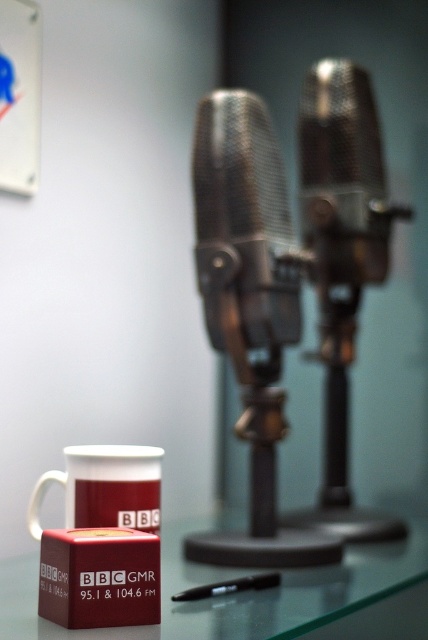
Can you confirm if matte cardboard box at lower left is positioned below black plastic pen at lower center?

No, matte cardboard box at lower left is not below black plastic pen at lower center.

Does matte cardboard box at lower left have a greater height compared to black plastic pen at lower center?

Indeed, matte cardboard box at lower left has a greater height compared to black plastic pen at lower center.

This screenshot has width=428, height=640. What do you see at coordinates (98, 577) in the screenshot? I see `matte cardboard box at lower left` at bounding box center [98, 577].

Identify the location of matte cardboard box at lower left. (98, 577).

Between matte cardboard box at lower left and white ceramic mug at lower left, which one is positioned higher?

white ceramic mug at lower left is above.

What do you see at coordinates (98, 577) in the screenshot? I see `matte cardboard box at lower left` at bounding box center [98, 577].

Who is more distant from viewer, (88,582) or (95,476)?

The point (95,476) is more distant.

This screenshot has height=640, width=428. In order to click on matte cardboard box at lower left in this screenshot , I will do `click(98, 577)`.

Does transparent glass table at lower center appear on the right side of black plastic pen at lower center?

Incorrect, transparent glass table at lower center is not on the right side of black plastic pen at lower center.

Is point (163, 550) closer to viewer compared to point (255, 582)?

No.

Which is in front, point (8, 602) or point (205, 596)?

Point (8, 602) is in front.

You are a GUI agent. You are given a task and a screenshot of the screen. Output one action in this format:
    pyautogui.click(x=<x>, y=<y>)
    Task: Click on the transparent glass table at lower center
    The width and height of the screenshot is (428, 640).
    Given the screenshot: What is the action you would take?
    pyautogui.click(x=235, y=593)